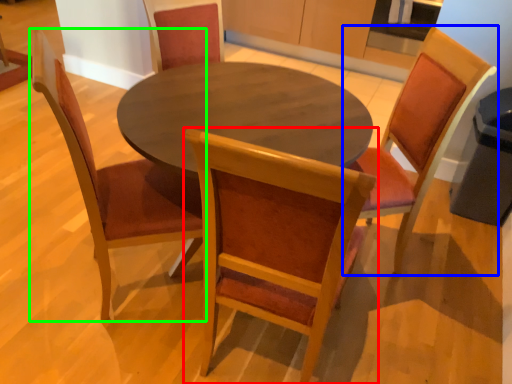
Question: Which is farther away from chair (highlighted by a red box)? chair (highlighted by a blue box) or chair (highlighted by a green box)?

Choices:
 (A) chair
 (B) chair

Answer: (A)